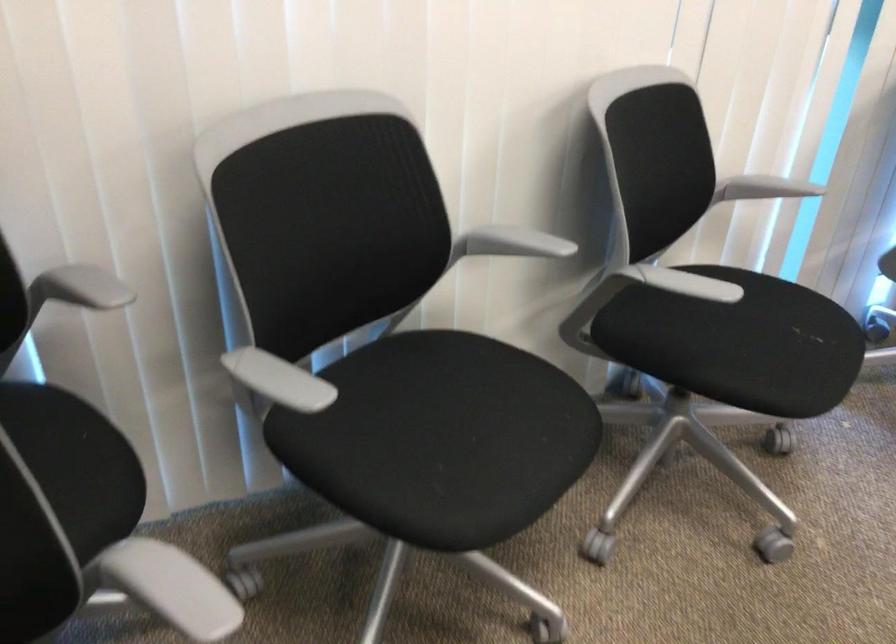
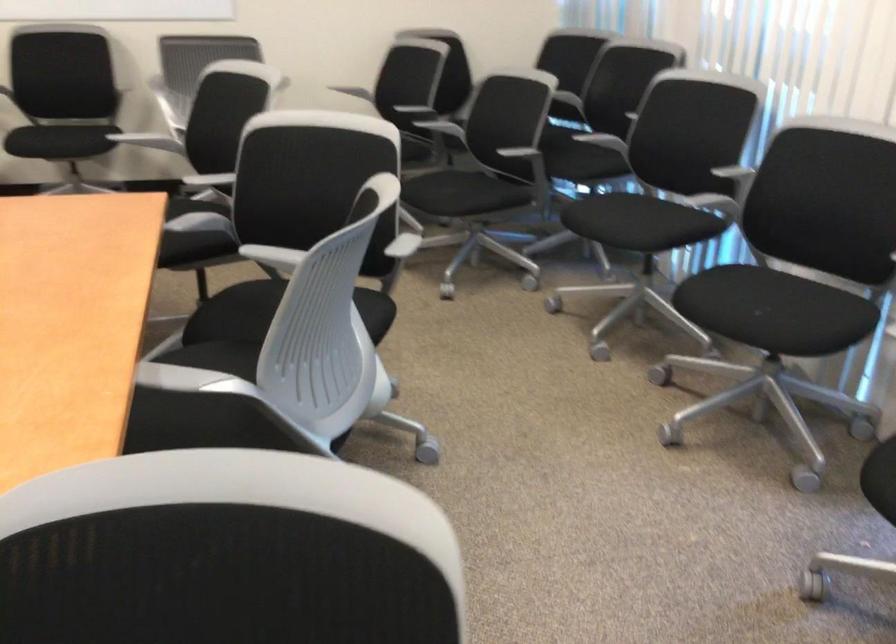
Find the pixel in the second image that matches point 507,429 in the first image.

(624, 221)